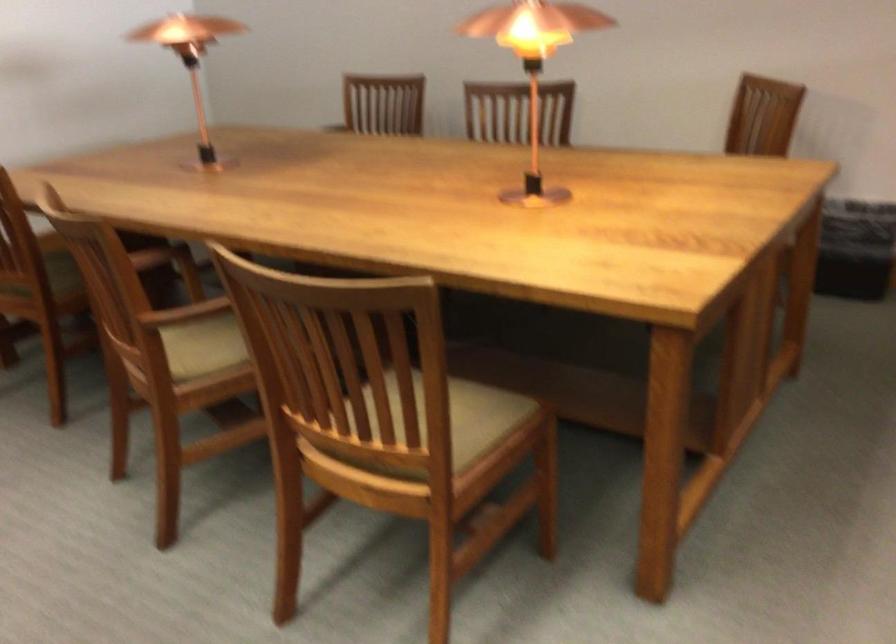
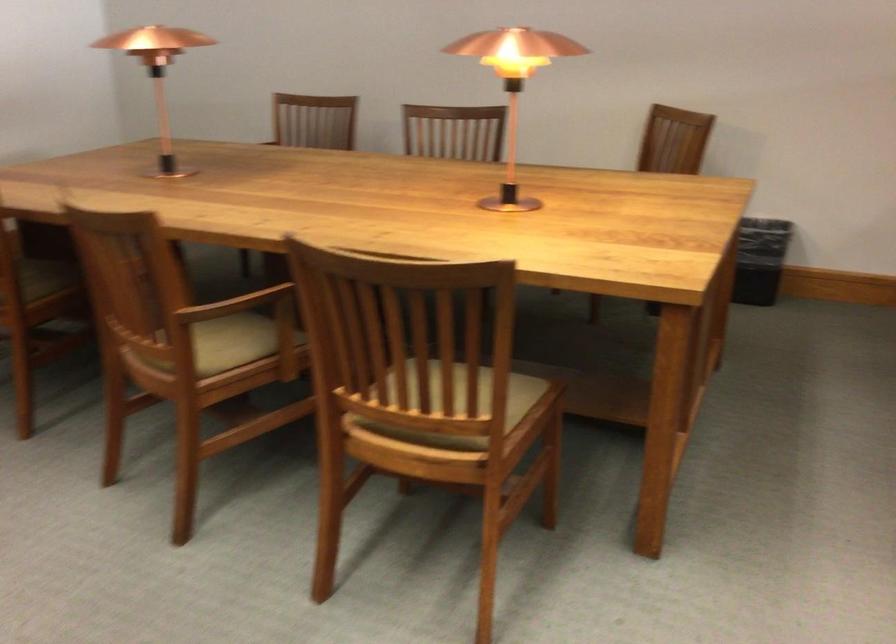
In the second image, find the point that corresponds to the point at 216,346 in the first image.

(228, 343)